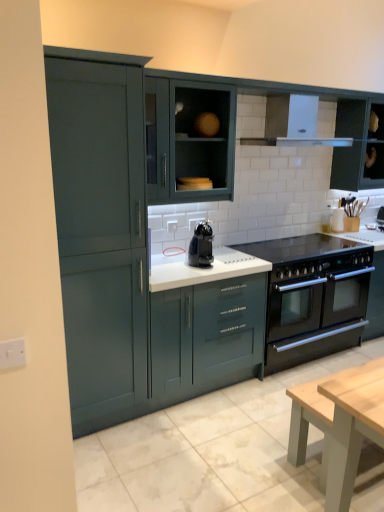
Measure the distance between white glossy exhaust hood at upper center and camera.

They are 3.15 meters apart.

Locate an element on the screen. The height and width of the screenshot is (512, 384). black matte oven at center-right is located at coordinates (315, 317).

Identify the location of matte green cabinet at left, which is the 5th cabinetry in right-to-left order. (100, 229).

Image resolution: width=384 pixels, height=512 pixels. What do you see at coordinates (12, 354) in the screenshot?
I see `white plastic switch at left, positioned as the 2th electric outlet in right-to-left order` at bounding box center [12, 354].

What is the approximate width of matte dark green cabinet at center, arranged as the 4th cabinetry when viewed from the left?

The width of matte dark green cabinet at center, arranged as the 4th cabinetry when viewed from the left, is 6.75 centimeters.

Locate an element on the screen. matte dark green cabinet at upper right, the 1th cabinetry from the right is located at coordinates (358, 146).

Is matte dark green cabinet at upper right, the 1th cabinetry from the right, far away from white plastic electric outlet at center, which ranks as the 2th electric outlet in left-to-right order?

That's right, there is a large distance between matte dark green cabinet at upper right, the 1th cabinetry from the right, and white plastic electric outlet at center, which ranks as the 2th electric outlet in left-to-right order.

Which object is closer to the camera taking this photo, matte dark green cabinet at upper right, the 1th cabinetry from the right, or white plastic electric outlet at center, which ranks as the 1th electric outlet in top-to-bottom order?

Positioned in front is white plastic electric outlet at center, which ranks as the 1th electric outlet in top-to-bottom order.

Which point is more forward, (370, 101) or (167, 222)?

The point (167, 222) is closer to the camera.

Does matte dark green cabinet at upper right, placed as the 5th cabinetry when sorted from left to right, turn towards white plastic electric outlet at center, which is counted as the 1th electric outlet, starting from the back?

No, matte dark green cabinet at upper right, placed as the 5th cabinetry when sorted from left to right, is not oriented towards white plastic electric outlet at center, which is counted as the 1th electric outlet, starting from the back.

From the image's perspective, is white plastic electric outlet at center, which is counted as the 1th electric outlet, starting from the back, on matte green cabinet at left, which is the 5th cabinetry in right-to-left order?

Yes.

Is white plastic electric outlet at center, the second electric outlet positioned from the bottom, aimed at matte green cabinet at left, which is the first cabinetry from left to right?

No, white plastic electric outlet at center, the second electric outlet positioned from the bottom, is not aimed at matte green cabinet at left, which is the first cabinetry from left to right.

Considering the sizes of objects white plastic electric outlet at center, marked as the 1th electric outlet in a right-to-left arrangement, and matte green cabinet at left, which is the first cabinetry from left to right, in the image provided, who is taller, white plastic electric outlet at center, marked as the 1th electric outlet in a right-to-left arrangement, or matte green cabinet at left, which is the first cabinetry from left to right,?

matte green cabinet at left, which is the first cabinetry from left to right, is taller.

Is white plastic electric outlet at center, the second electric outlet positioned from the bottom, positioned before matte green cabinet at left, which is the first cabinetry from left to right?

No, it is behind matte green cabinet at left, which is the first cabinetry from left to right.

Between glossy teal cabinet at center, which is the 3th cabinetry in left-to-right order, and white plastic switch at left, the 1th electric outlet in the front-to-back sequence, which one has smaller size?

Smaller between the two is white plastic switch at left, the 1th electric outlet in the front-to-back sequence.

Do you think glossy teal cabinet at center, the third cabinetry positioned from the right, is within white plastic switch at left, the first electric outlet ordered from the bottom, or outside of it?

glossy teal cabinet at center, the third cabinetry positioned from the right, lies outside white plastic switch at left, the first electric outlet ordered from the bottom.

In the scene shown: How many degrees apart are the facing directions of glossy teal cabinet at center, which is the 3th cabinetry in left-to-right order, and white plastic switch at left, the 1th electric outlet in the front-to-back sequence?

The facing directions of glossy teal cabinet at center, which is the 3th cabinetry in left-to-right order, and white plastic switch at left, the 1th electric outlet in the front-to-back sequence, are 1.35 degrees apart.

Locate an element on the screen. the 2nd cabinetry counting from the right of the white plastic switch at left, the first electric outlet ordered from the bottom is located at coordinates (206, 336).

Which point is more distant from viewer, [337,109] or [160,197]?

Point [337,109]

From the image's perspective, which is below, matte dark green cabinet at upper right, placed as the 5th cabinetry when sorted from left to right, or matte green cabinet at upper center, marked as the 4th cabinetry in a right-to-left arrangement?

From the image's view, matte green cabinet at upper center, marked as the 4th cabinetry in a right-to-left arrangement, is below.

In the scene shown: Would you say matte green cabinet at upper center, which appears as the second cabinetry when viewed from the left, is part of matte dark green cabinet at upper right, the 1th cabinetry from the right,'s contents?

Definitely not — matte green cabinet at upper center, which appears as the second cabinetry when viewed from the left, is not inside matte dark green cabinet at upper right, the 1th cabinetry from the right.

Looking at this image, from a real-world perspective, which is physically above, matte dark green cabinet at upper right, placed as the 5th cabinetry when sorted from left to right, or matte green cabinet at upper center, which appears as the second cabinetry when viewed from the left?

From a 3D spatial view, matte dark green cabinet at upper right, placed as the 5th cabinetry when sorted from left to right, is above.

From a real-world perspective, who is located lower, black glossy coffee machine at center or black glass gas stove at center?

From a 3D spatial view, black glass gas stove at center is below.

Is black glossy coffee machine at center positioned beyond the bounds of black glass gas stove at center?

Yes, black glossy coffee machine at center is outside of black glass gas stove at center.

Is black glass gas stove at center at the back of black glossy coffee machine at center?

black glossy coffee machine at center is not turned away from black glass gas stove at center.

Is black glossy coffee machine at center in front of or behind black glass gas stove at center in the image?

Visually, black glossy coffee machine at center is located in front of black glass gas stove at center.

From a real-world perspective, is matte green cabinet at left, which is the first cabinetry from left to right, beneath matte green cabinet at upper center, marked as the 4th cabinetry in a right-to-left arrangement?

Indeed, from a real-world perspective, matte green cabinet at left, which is the first cabinetry from left to right, is positioned beneath matte green cabinet at upper center, marked as the 4th cabinetry in a right-to-left arrangement.

Considering the positions of points (89, 158) and (201, 131), is point (89, 158) closer to camera compared to point (201, 131)?

Yes, it is.

Would you say matte green cabinet at left, which is the first cabinetry from left to right, is to the left or to the right of matte green cabinet at upper center, marked as the 4th cabinetry in a right-to-left arrangement, in the picture?

Clearly, matte green cabinet at left, which is the first cabinetry from left to right, is on the left of matte green cabinet at upper center, marked as the 4th cabinetry in a right-to-left arrangement, in the image.

Is matte green cabinet at left, which is the 5th cabinetry in right-to-left order, far from matte green cabinet at upper center, which appears as the second cabinetry when viewed from the left?

No.

Is matte dark green cabinet at center, arranged as the 4th cabinetry when viewed from the left, positioned with its back to matte dark green cabinet at upper right, placed as the 5th cabinetry when sorted from left to right?

Yes, matte dark green cabinet at center, arranged as the 4th cabinetry when viewed from the left,'s orientation is away from matte dark green cabinet at upper right, placed as the 5th cabinetry when sorted from left to right.

Which is more distant, (230,150) or (371,169)?

The point (371,169) is behind.

How much distance is there between matte dark green cabinet at center, the 2th cabinetry from the right, and matte dark green cabinet at upper right, placed as the 5th cabinetry when sorted from left to right?

A distance of 43.62 centimeters exists between matte dark green cabinet at center, the 2th cabinetry from the right, and matte dark green cabinet at upper right, placed as the 5th cabinetry when sorted from left to right.

How different are the orientations of matte dark green cabinet at center, arranged as the 4th cabinetry when viewed from the left, and matte dark green cabinet at upper right, the 1th cabinetry from the right, in degrees?

The angular difference between matte dark green cabinet at center, arranged as the 4th cabinetry when viewed from the left, and matte dark green cabinet at upper right, the 1th cabinetry from the right, is 0.602 degrees.

Find the location of a particular element. Image resolution: width=384 pixels, height=512 pixels. the 3rd cabinetry positioned above the white plastic electric outlet at center, the second electric outlet positioned from the bottom (from a real-world perspective) is located at coordinates (358, 146).

Locate an element on the screen. This screenshot has width=384, height=512. electric outlet lying above the matte green cabinet at left, which is the 5th cabinetry in right-to-left order (from the image's perspective) is located at coordinates (172, 226).

When comparing their distances from white plastic electric outlet at center, the second electric outlet positioned from the bottom, does black matte oven at center-right or black glass gas stove at center seem further?

black matte oven at center-right.

Considering their positions, is black glass gas stove at center positioned further to matte green cabinet at upper center, which appears as the second cabinetry when viewed from the left, than matte dark green cabinet at upper right, the 1th cabinetry from the right?

matte dark green cabinet at upper right, the 1th cabinetry from the right, is further to matte green cabinet at upper center, which appears as the second cabinetry when viewed from the left.

Which object lies nearer to the anchor point black glass gas stove at center, black matte oven at center-right or glossy teal cabinet at center, the third cabinetry positioned from the right?

black matte oven at center-right is positioned closer to the anchor black glass gas stove at center.

Estimate the real-world distances between objects in this image. Which object is closer to white glossy exhaust hood at upper center, matte green cabinet at upper center, which appears as the second cabinetry when viewed from the left, or white plastic electric outlet at center, arranged as the second electric outlet when viewed from the front?

The object closer to white glossy exhaust hood at upper center is matte green cabinet at upper center, which appears as the second cabinetry when viewed from the left.

Which object lies further to the anchor point glossy teal cabinet at center, which is the 3th cabinetry in left-to-right order, matte dark green cabinet at center, arranged as the 4th cabinetry when viewed from the left, or white plastic electric outlet at center, marked as the 1th electric outlet in a right-to-left arrangement?

matte dark green cabinet at center, arranged as the 4th cabinetry when viewed from the left, is positioned further to the anchor glossy teal cabinet at center, which is the 3th cabinetry in left-to-right order.

Estimate the real-world distances between objects in this image. Which object is closer to white glossy exhaust hood at upper center, white plastic switch at left, the 1th electric outlet in the front-to-back sequence, or black glossy coffee machine at center?

black glossy coffee machine at center lies closer to white glossy exhaust hood at upper center than the other object.

From the image, which object appears to be nearer to black glossy coffee machine at center, white plastic electric outlet at center, marked as the 1th electric outlet in a right-to-left arrangement, or matte dark green cabinet at upper right, placed as the 5th cabinetry when sorted from left to right?

white plastic electric outlet at center, marked as the 1th electric outlet in a right-to-left arrangement, is positioned closer to the anchor black glossy coffee machine at center.

Estimate the real-world distances between objects in this image. Which object is closer to black matte oven at center-right, white plastic electric outlet at center, the second electric outlet positioned from the bottom, or black glossy coffee machine at center?

black glossy coffee machine at center lies closer to black matte oven at center-right than the other object.

Locate an element on the screen. exhaust hood located between white plastic switch at left, the first electric outlet ordered from the bottom, and matte dark green cabinet at center, the 2th cabinetry from the right, in the depth direction is located at coordinates (293, 123).

Locate an element on the screen. This screenshot has width=384, height=512. kitchen appliance between glossy teal cabinet at center, the third cabinetry positioned from the right, and matte dark green cabinet at upper right, the 1th cabinetry from the right, from left to right is located at coordinates (201, 246).

In order to click on oven between glossy teal cabinet at center, the third cabinetry positioned from the right, and matte dark green cabinet at upper right, the 1th cabinetry from the right in this screenshot , I will do `click(315, 317)`.

Locate an element on the screen. The height and width of the screenshot is (512, 384). gas stove situated between matte green cabinet at upper center, which appears as the second cabinetry when viewed from the left, and matte dark green cabinet at upper right, placed as the 5th cabinetry when sorted from left to right, from left to right is located at coordinates (300, 247).